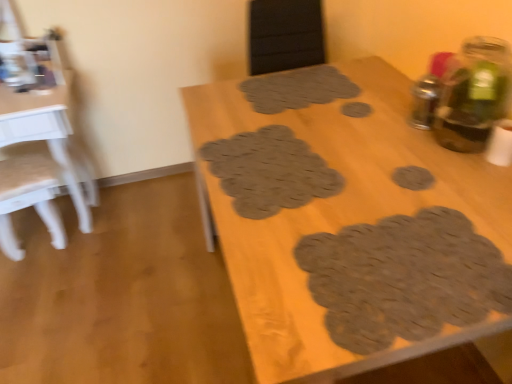
I want to click on free space between metallic silver bottle at upper right, which is counted as the first bottle, starting from the back, and brown textured mat at center, positioned as the 3th footprint in top-to-bottom order, so click(x=366, y=143).